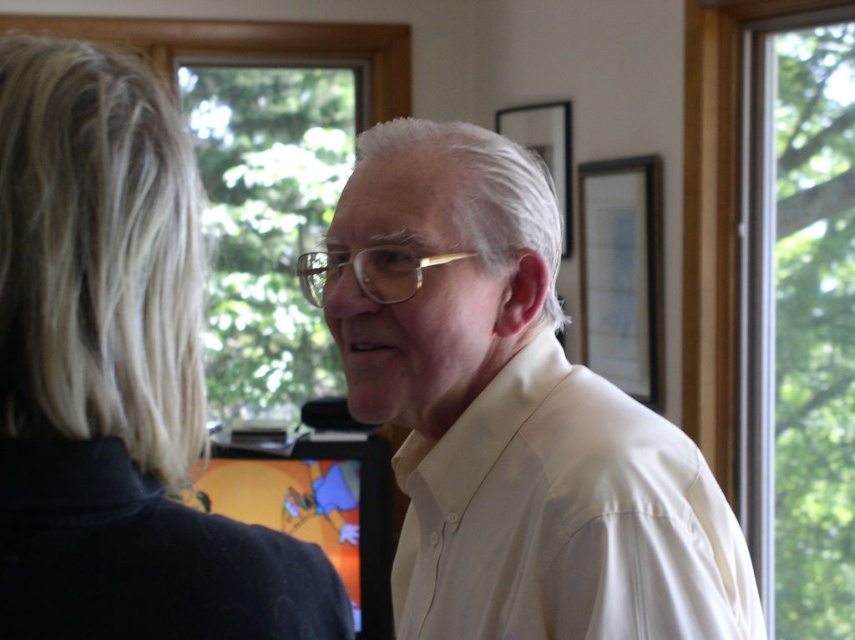
Is white matte shirt at center behind transparent glass window at upper center?

No, it is in front of transparent glass window at upper center.

Is white matte shirt at center below transparent glass window at upper center?

Indeed, white matte shirt at center is positioned under transparent glass window at upper center.

Where is `white matte shirt at center`? Image resolution: width=855 pixels, height=640 pixels. white matte shirt at center is located at coordinates (510, 413).

Does white smooth dress shirt at center appear on the left side of clear glass window at right?

Yes, white smooth dress shirt at center is to the left of clear glass window at right.

At what (x,y) coordinates should I click in order to perform the action: click on white smooth dress shirt at center. Please return your answer as a coordinate pair (x, y). Looking at the image, I should click on (565, 518).

Where is `white smooth dress shirt at center`? Image resolution: width=855 pixels, height=640 pixels. white smooth dress shirt at center is located at coordinates (565, 518).

Does white matte shirt at center have a greater height compared to blonde hair at left?

Indeed, white matte shirt at center has a greater height compared to blonde hair at left.

The height and width of the screenshot is (640, 855). Find the location of `white matte shirt at center`. white matte shirt at center is located at coordinates (510, 413).

I want to click on white matte shirt at center, so click(510, 413).